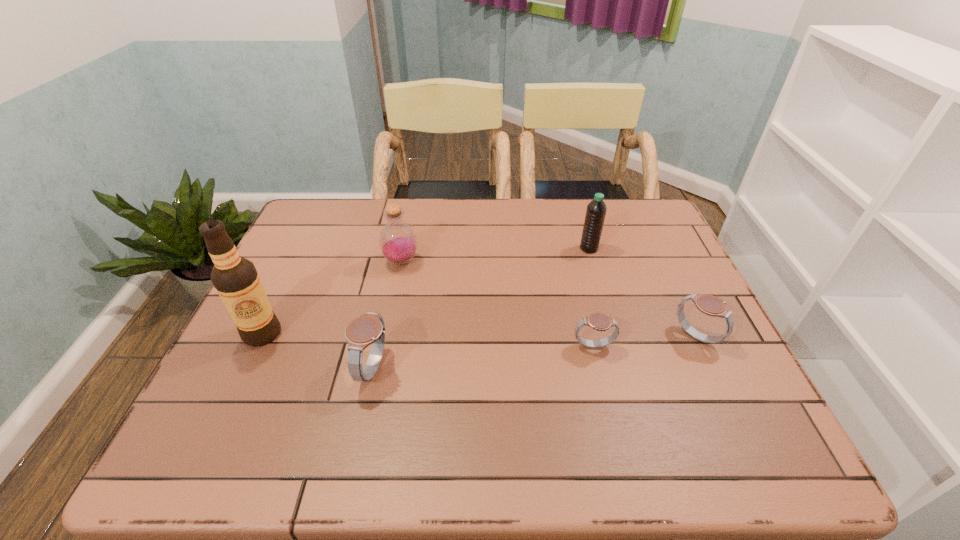
Please point a space for a new watch to maintain equal intervals. Please provide its 2D coordinates. Your answer should be formatted as a tuple, i.e. [(x, y)], where the tuple contains the x and y coordinates of a point satisfying the conditions above.

[(487, 357)]